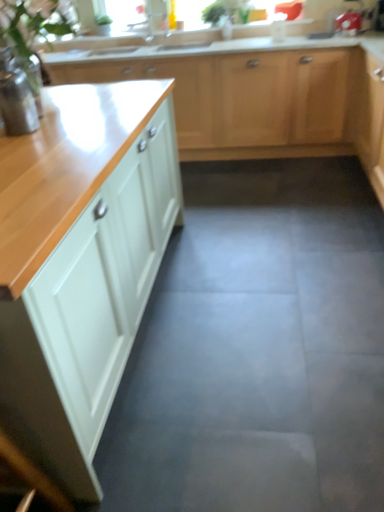
Question: Considering the relative sizes of white glossy cabinet at left, the second cabinetry viewed from the back, and gray concrete floor at center in the image provided, is white glossy cabinet at left, the second cabinetry viewed from the back, wider than gray concrete floor at center?

Choices:
 (A) no
 (B) yes

Answer: (A)

Question: Can you confirm if white glossy cabinet at left, the second cabinetry viewed from the back, is taller than gray concrete floor at center?

Choices:
 (A) yes
 (B) no

Answer: (A)

Question: Is white glossy cabinet at left, the second cabinetry viewed from the back, thinner than gray concrete floor at center?

Choices:
 (A) no
 (B) yes

Answer: (B)

Question: Are white glossy cabinet at left, which is the 2th cabinetry from top to bottom, and gray concrete floor at center making contact?

Choices:
 (A) no
 (B) yes

Answer: (A)

Question: Is white glossy cabinet at left, the second cabinetry viewed from the back, not near gray concrete floor at center?

Choices:
 (A) yes
 (B) no

Answer: (B)

Question: Can you confirm if white glossy cabinet at left, arranged as the first cabinetry when ordered from the bottom, is shorter than gray concrete floor at center?

Choices:
 (A) no
 (B) yes

Answer: (A)

Question: Considering the relative sizes of gray concrete floor at center and green leafy plant at upper center in the image provided, is gray concrete floor at center taller than green leafy plant at upper center?

Choices:
 (A) yes
 (B) no

Answer: (A)

Question: Considering the relative sizes of gray concrete floor at center and green leafy plant at upper center in the image provided, is gray concrete floor at center wider than green leafy plant at upper center?

Choices:
 (A) no
 (B) yes

Answer: (B)

Question: Can you confirm if gray concrete floor at center is thinner than green leafy plant at upper center?

Choices:
 (A) no
 (B) yes

Answer: (A)

Question: Considering the relative positions of gray concrete floor at center and green leafy plant at upper center in the image provided, is gray concrete floor at center in front of green leafy plant at upper center?

Choices:
 (A) yes
 (B) no

Answer: (A)

Question: Is gray concrete floor at center positioned far away from green leafy plant at upper center?

Choices:
 (A) yes
 (B) no

Answer: (A)

Question: From the image's perspective, would you say gray concrete floor at center is positioned over green leafy plant at upper center?

Choices:
 (A) yes
 (B) no

Answer: (B)

Question: Is white glossy cabinet at left, the first cabinetry from the front, at the right side of green leafy plant at upper center?

Choices:
 (A) no
 (B) yes

Answer: (A)